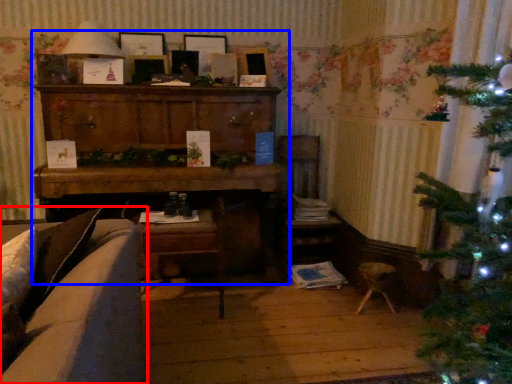
Question: Which point is further to the camera, studio couch (highlighted by a red box) or entertainment center (highlighted by a blue box)?

Choices:
 (A) studio couch
 (B) entertainment center

Answer: (B)